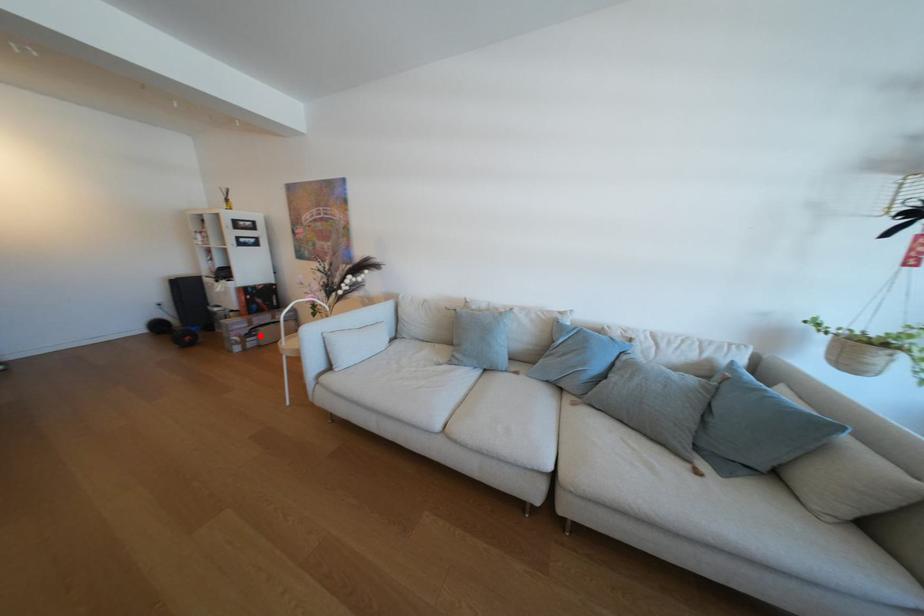
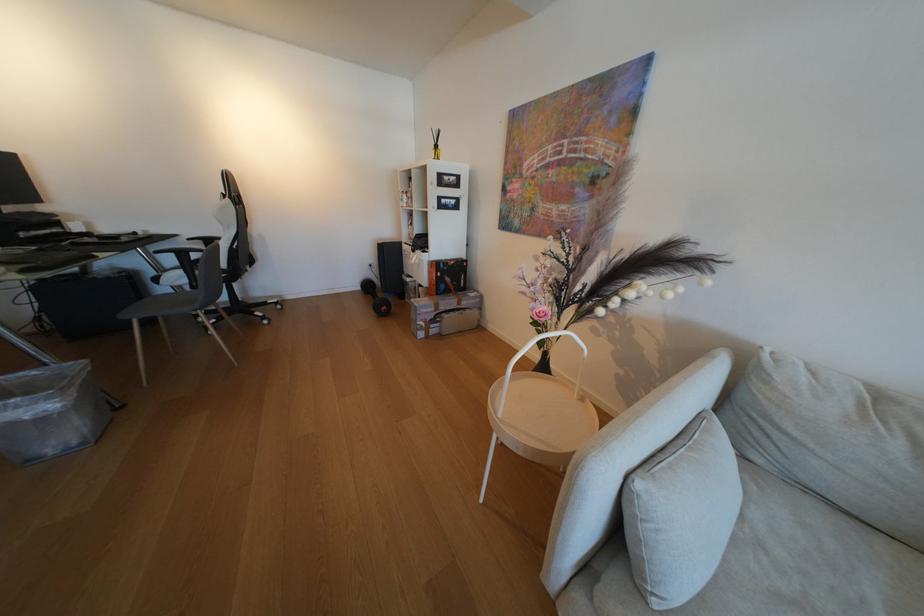
Question: I am providing you with two images of the same scene from different viewpoints. A red point is shown in image1. For the corresponding object point in image2, is it positioned nearer or farther from the camera?

Choices:
 (A) Nearer
 (B) Farther

Answer: (A)